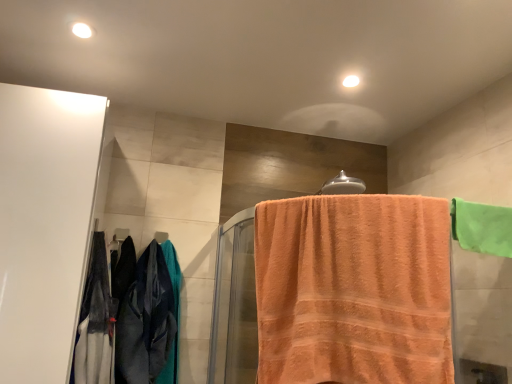
Question: Does velvet-like dark blue pants at left have a lesser width compared to green fabric towel at upper right, which is counted as the first towel, starting from the right?

Choices:
 (A) yes
 (B) no

Answer: (B)

Question: Considering the relative sizes of velvet-like dark blue pants at left and green fabric towel at upper right, which is counted as the first towel, starting from the right, in the image provided, is velvet-like dark blue pants at left bigger than green fabric towel at upper right, which is counted as the first towel, starting from the right,?

Choices:
 (A) yes
 (B) no

Answer: (A)

Question: Does velvet-like dark blue pants at left have a smaller size compared to green fabric towel at upper right, which is counted as the first towel, starting from the right?

Choices:
 (A) no
 (B) yes

Answer: (A)

Question: From the image's perspective, would you say velvet-like dark blue pants at left is positioned over green fabric towel at upper right, the 2th towel viewed from the left?

Choices:
 (A) no
 (B) yes

Answer: (A)

Question: Is velvet-like dark blue pants at left touching green fabric towel at upper right, which is counted as the first towel, starting from the right?

Choices:
 (A) yes
 (B) no

Answer: (B)

Question: Does point (96, 311) appear closer or farther from the camera than point (262, 208)?

Choices:
 (A) closer
 (B) farther

Answer: (B)

Question: Is velvet-like dark blue pants at left inside or outside of orange terry cloth towel at center, which is counted as the 2th towel, starting from the right?

Choices:
 (A) inside
 (B) outside

Answer: (B)

Question: In terms of size, does velvet-like dark blue pants at left appear bigger or smaller than orange terry cloth towel at center, the 1th towel positioned from the left?

Choices:
 (A) small
 (B) big

Answer: (A)

Question: From a real-world perspective, is velvet-like dark blue pants at left physically located above or below orange terry cloth towel at center, which is counted as the 2th towel, starting from the right?

Choices:
 (A) above
 (B) below

Answer: (B)

Question: Is silver metallic towel bar at upper center, positioned as the 1th towel bar in front-to-back order, taller or shorter than green fabric towel at upper right, the 2th towel viewed from the left?

Choices:
 (A) short
 (B) tall

Answer: (A)

Question: Based on their sizes in the image, would you say silver metallic towel bar at upper center, marked as the 2th towel bar in a bottom-to-top arrangement, is bigger or smaller than green fabric towel at upper right, the 2th towel viewed from the left?

Choices:
 (A) small
 (B) big

Answer: (A)

Question: Is point (330, 182) positioned closer to the camera than point (480, 223)?

Choices:
 (A) farther
 (B) closer

Answer: (A)

Question: Looking at their shapes, would you say silver metallic towel bar at upper center, acting as the first towel bar starting from the right, is wider or thinner than green fabric towel at upper right, which is counted as the first towel, starting from the right?

Choices:
 (A) thin
 (B) wide

Answer: (B)

Question: Is point (474, 241) closer or farther from the camera than point (16, 236)?

Choices:
 (A) closer
 (B) farther

Answer: (A)

Question: Considering the relative positions of green fabric towel at upper right, which is counted as the first towel, starting from the right, and white glossy cabinet at left in the image provided, is green fabric towel at upper right, which is counted as the first towel, starting from the right, to the left or to the right of white glossy cabinet at left?

Choices:
 (A) right
 (B) left

Answer: (A)